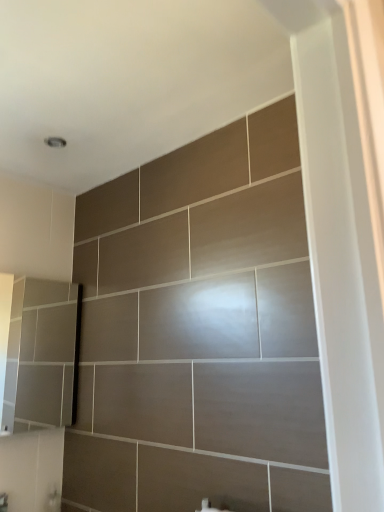
Question: Should I look upward or downward to see matte gray medicine cabinet at lower left?

Choices:
 (A) down
 (B) up

Answer: (A)